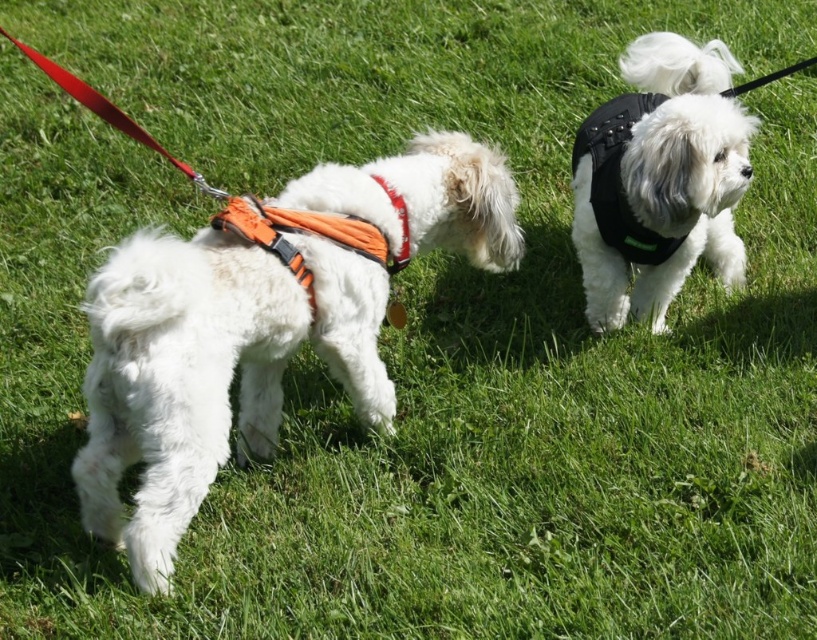
Question: Is white soft fur dog at left smaller than orange fabric neckband at center?

Choices:
 (A) yes
 (B) no

Answer: (B)

Question: Can you confirm if white soft fur dog at left is positioned to the right of black matte vest at upper right?

Choices:
 (A) yes
 (B) no

Answer: (B)

Question: Is white soft fur dog at left to the right of black matte vest at upper right from the viewer's perspective?

Choices:
 (A) yes
 (B) no

Answer: (B)

Question: Estimate the real-world distances between objects in this image. Which object is farther from the orange fabric neckband at center?

Choices:
 (A) black matte vest at upper right
 (B) white soft fur dog at left

Answer: (A)

Question: Which point is closer to the camera?

Choices:
 (A) white soft fur dog at left
 (B) orange fabric neckband at center
 (C) black matte vest at upper right

Answer: (A)

Question: Which of the following is the closest to the observer?

Choices:
 (A) (673, 145)
 (B) (407, 257)

Answer: (B)